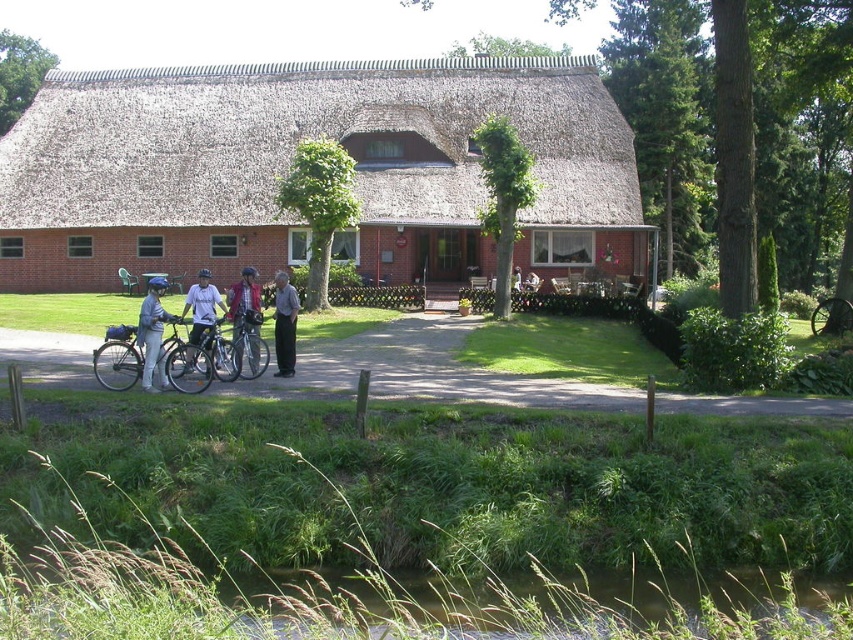
Question: Which object is farther from the camera taking this photo?

Choices:
 (A) matte black bicycle at lower left
 (B) silver metallic bicycle at center

Answer: (B)

Question: Which object is farther from the camera taking this photo?

Choices:
 (A) matte red jacket at center
 (B) green grass at lower center
 (C) thatched roof cottage at center
 (D) matte black bicycle at lower left

Answer: (C)

Question: Which object is positioned closest to the silver metallic bicycle at center?

Choices:
 (A) thatched roof cottage at center
 (B) matte blue helmet at left

Answer: (B)

Question: Does matte blue helmet at left appear over dark gray pants at center?

Choices:
 (A) yes
 (B) no

Answer: (B)

Question: Is green grassy creek at lower center above matte white bicycle at center?

Choices:
 (A) no
 (B) yes

Answer: (A)

Question: Does green grass at lower center appear over dark gray pants at center?

Choices:
 (A) no
 (B) yes

Answer: (A)